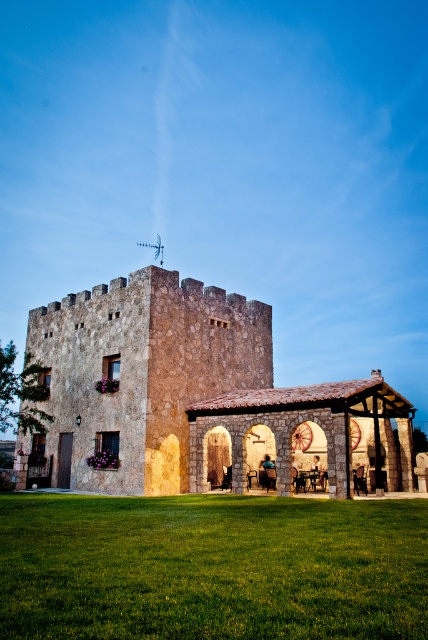
Question: Is green grass at lower center in front of rustic stone castle at center?

Choices:
 (A) no
 (B) yes

Answer: (B)

Question: Is green grass at lower center to the left of rustic stone castle at center from the viewer's perspective?

Choices:
 (A) no
 (B) yes

Answer: (A)

Question: Does green grass at lower center appear on the right side of rustic stone castle at center?

Choices:
 (A) yes
 (B) no

Answer: (A)